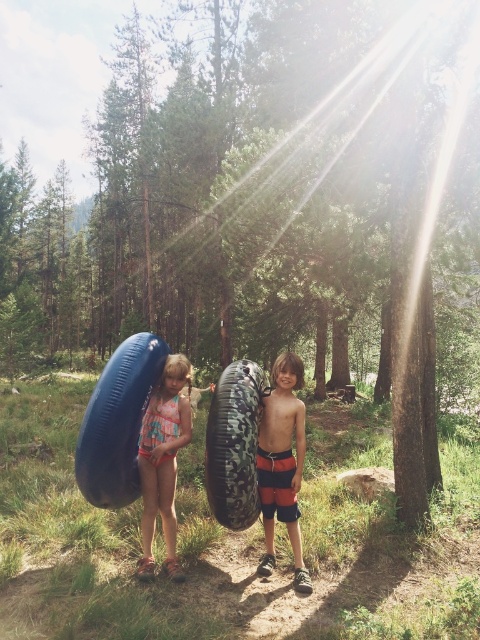
You are a delivery robot with a width of 0.8 meters. You need to move from the blue rubber tube at left to the orange striped shorts at center. Is there enough space for you to pass through the gap between them?

The distance between the blue rubber tube at left and orange striped shorts at center is 1.03 meters. Since the robot is 0.8 meters wide, there is sufficient space for it to pass through the gap between them.

You are a drone operator trying to capture a photo of the two children in the forest. You have two points marked on your screen for positioning the drone. The first point is at coordinates point(x=252, y=467) and the second point is at point(x=284, y=436). Which point should you choose to ensure the drone is closer to the children?

Point point(x=252, y=467) is in front of point(x=284, y=436), so choosing point(x=252, y=467) will position the drone closer to the children.

You are a photographer trying to capture the orange striped shorts at center in the image. According to the coordinates provided, where exactly should you focus your camera lens?

The orange striped shorts at center is located at coordinates point (283, 464).